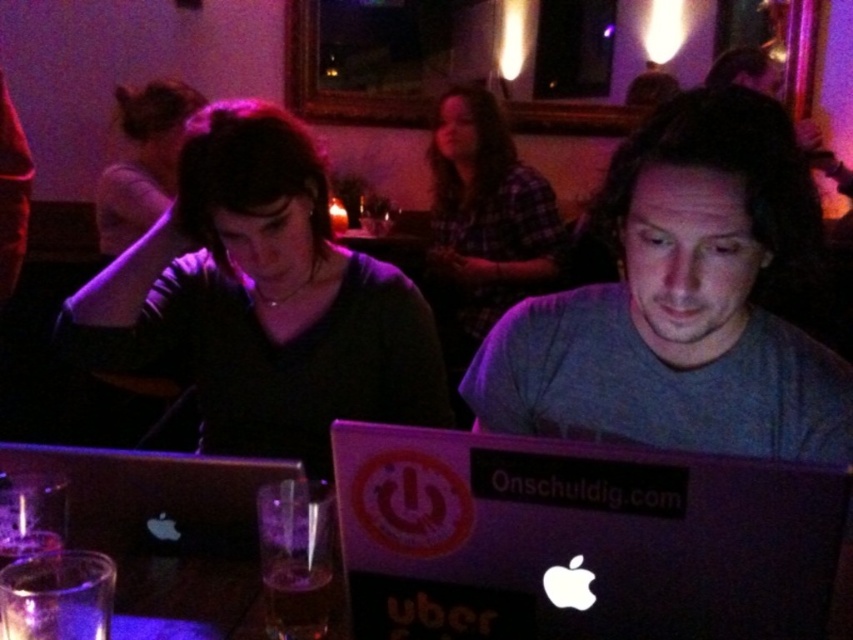
Question: Is gray matte shirt at center smaller than plaid fabric shirt at center?

Choices:
 (A) yes
 (B) no

Answer: (A)

Question: Does gray matte shirt at center have a greater width compared to plaid fabric shirt at center?

Choices:
 (A) no
 (B) yes

Answer: (A)

Question: Which of the following is the farthest from the observer?

Choices:
 (A) (613, 621)
 (B) (321, 328)
 (C) (532, 198)

Answer: (C)

Question: Among these objects, which one is nearest to the camera?

Choices:
 (A) plaid fabric shirt at center
 (B) black matte laptop at center

Answer: (B)

Question: Which point is farther to the camera?

Choices:
 (A) gray matte shirt at center
 (B) matte black shirt at upper center
 (C) plaid fabric shirt at center
 (D) black matte laptop at center

Answer: (C)

Question: Is matte black shirt at center wider than silver metallic laptop at center?

Choices:
 (A) no
 (B) yes

Answer: (B)